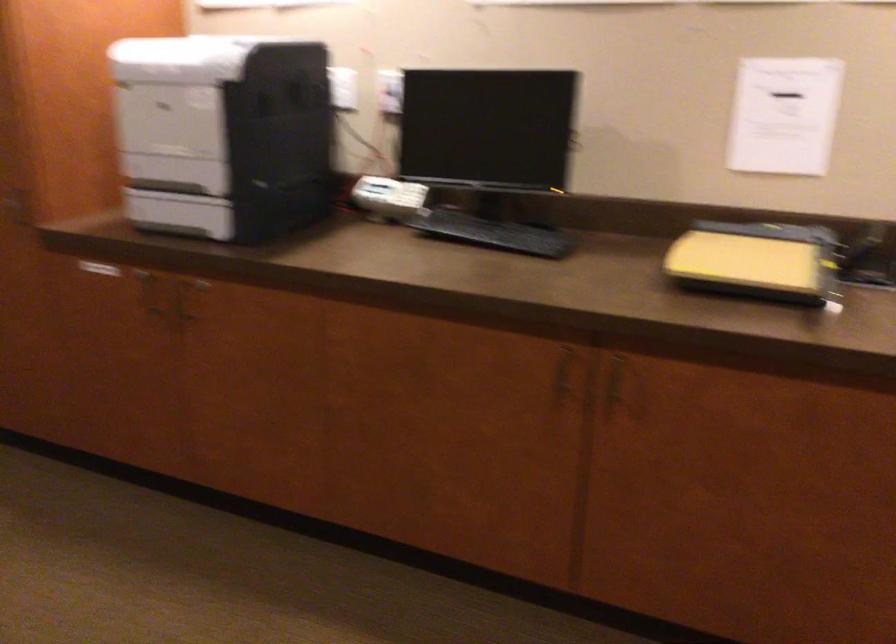
This screenshot has height=644, width=896. Describe the element at coordinates (195, 57) in the screenshot. I see `the printer scanner lid` at that location.